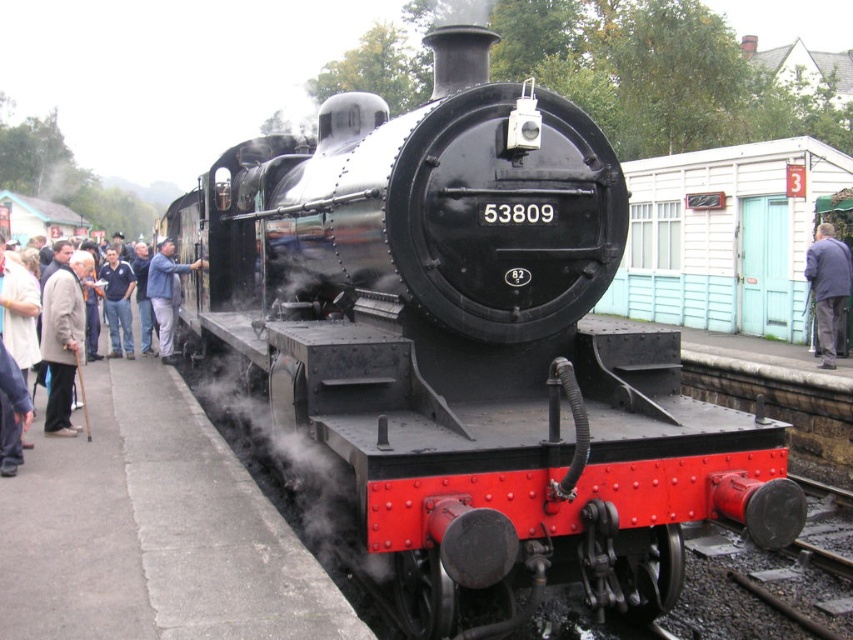
Does light beige coat at left have a larger size compared to denim jacket at left?

Incorrect, light beige coat at left is not larger than denim jacket at left.

Who is shorter, light beige coat at left or denim jacket at left?

light beige coat at left

Is point (59, 330) positioned behind point (108, 314)?

No, it is in front of (108, 314).

Locate an element on the screen. This screenshot has height=640, width=853. light beige coat at left is located at coordinates (62, 339).

Does light brown leather jacket at left have a larger size compared to denim jacket at left?

No.

Can you confirm if light brown leather jacket at left is taller than denim jacket at left?

Incorrect, light brown leather jacket at left's height is not larger of denim jacket at left's.

Is point (55, 416) less distant than point (112, 355)?

Yes, point (55, 416) is closer to viewer.

The height and width of the screenshot is (640, 853). Identify the location of light brown leather jacket at left. [62, 339].

Measure the distance between point (169, 304) and camera.

They are 12.24 meters apart.

Is blue denim jacket at left bigger than denim jacket at left?

Yes.

Which is in front, point (160, 296) or point (122, 307)?

Positioned in front is point (160, 296).

The height and width of the screenshot is (640, 853). In order to click on blue denim jacket at left in this screenshot , I will do `click(166, 292)`.